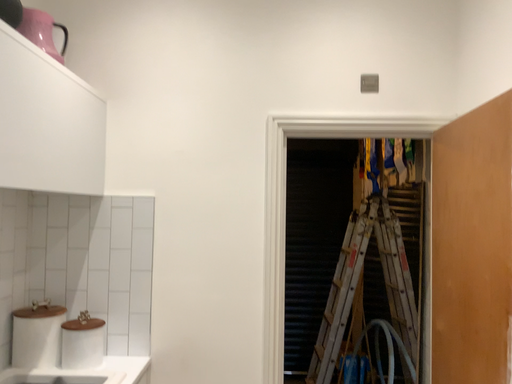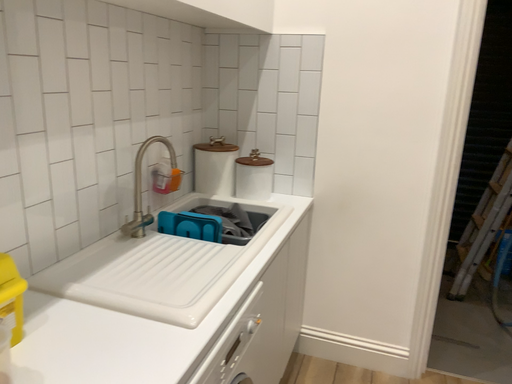
Question: How did the camera likely rotate when shooting the video?

Choices:
 (A) rotated left
 (B) rotated right

Answer: (A)